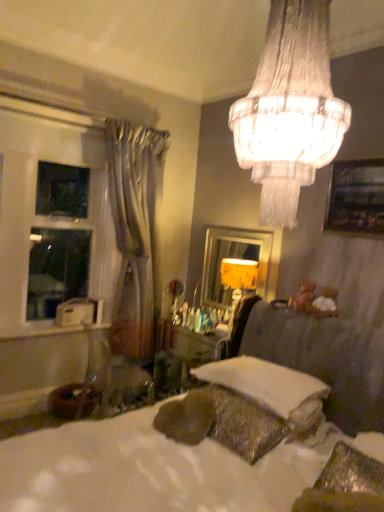
Question: From a real-world perspective, is white glossy window at left physically located above or below white soft pillow at lower center?

Choices:
 (A) below
 (B) above

Answer: (B)

Question: Is white glossy window at left bigger or smaller than white soft pillow at lower center?

Choices:
 (A) small
 (B) big

Answer: (B)

Question: Based on their relative distances, which object is nearer to the white textured bed at center?

Choices:
 (A) wooden framed picture at upper right
 (B) silvery drapery at left
 (C) white glossy window at left
 (D) white soft pillow at lower center
 (E) yellow fabric mirror at center

Answer: (D)

Question: Estimate the real-world distances between objects in this image. Which object is farther from the crystalline glass chandelier at upper center?

Choices:
 (A) silvery drapery at left
 (B) yellow fabric mirror at center
 (C) white glossy window at left
 (D) white textured bed at center
 (E) wooden framed picture at upper right

Answer: (C)